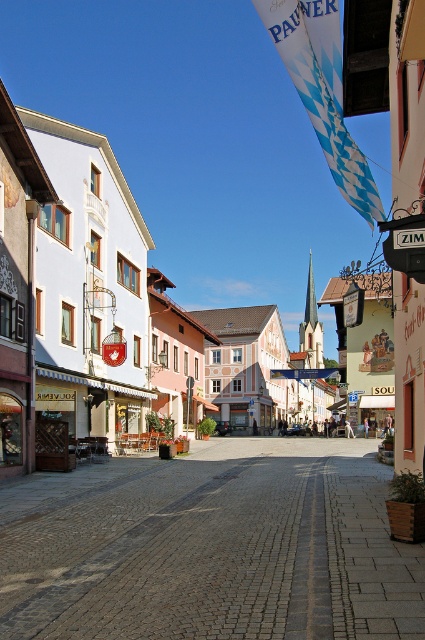
You are standing on the cobblestone street at center and want to take a photo of the white painted building at left. Which direction should you face to ensure the building is fully in the frame?

The cobblestone street at center is positioned under the white painted building at left, so you should face upward to ensure the white painted building at left is fully in the frame.

You are standing on the cobblestone street in the quaint European town. You see two points marked on the ground. One is at point [167,536] and the other is at point [19,436]. Which point is closer to you?

Point [167,536] is closer to you than point [19,436].

You are a tourist standing on the cobblestone street at center and want to take a photo of the white painted building at left. Which direction should you face to capture the building in your shot?

You should face to the left because the cobblestone street at center is positioned on the right side of white painted building at left, meaning the building is to your left side.